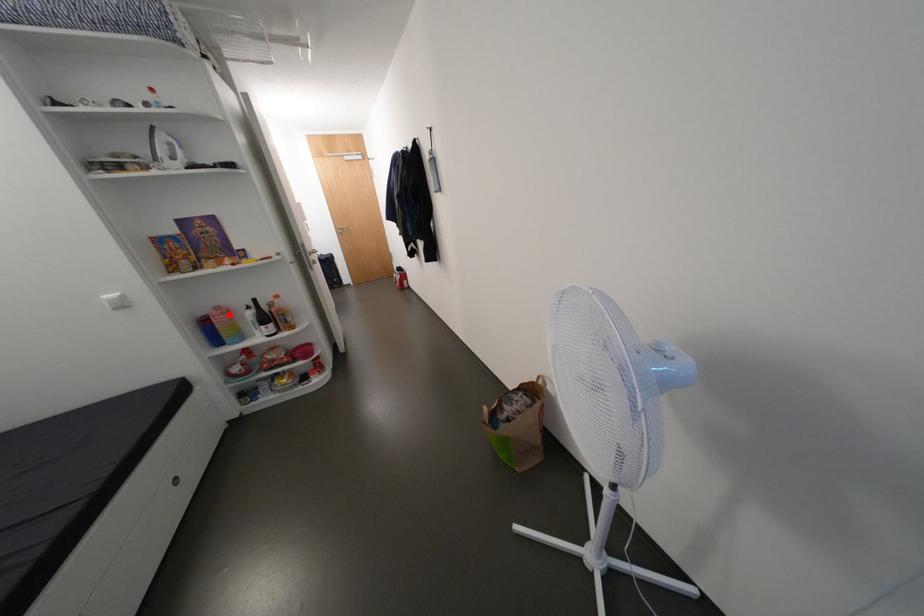
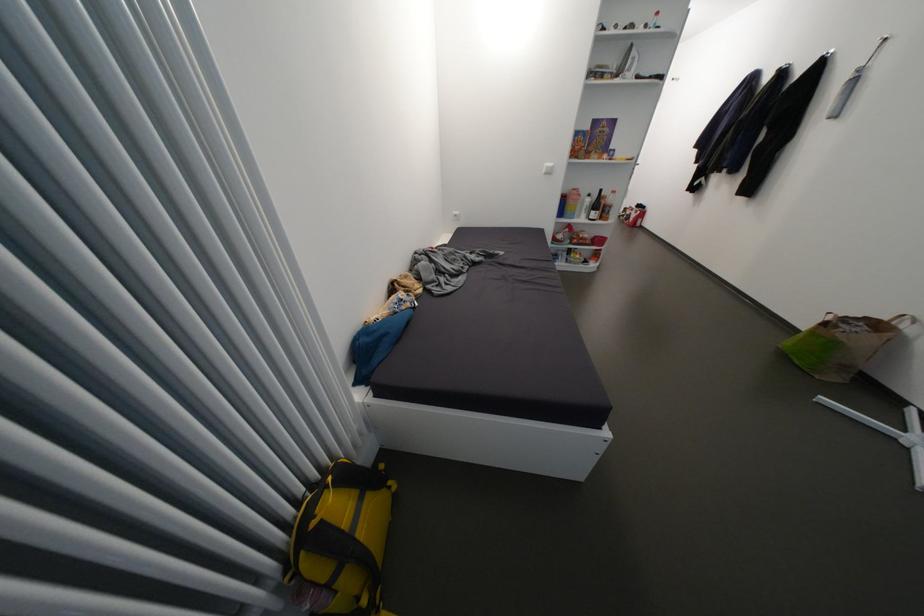
Question: A red point is marked in image1. In image2, is the corresponding 3D point closer to the camera or farther? Reply with the corresponding letter.

Choices:
 (A) The corresponding 3D point is closer.
 (B) The corresponding 3D point is farther.

Answer: (A)